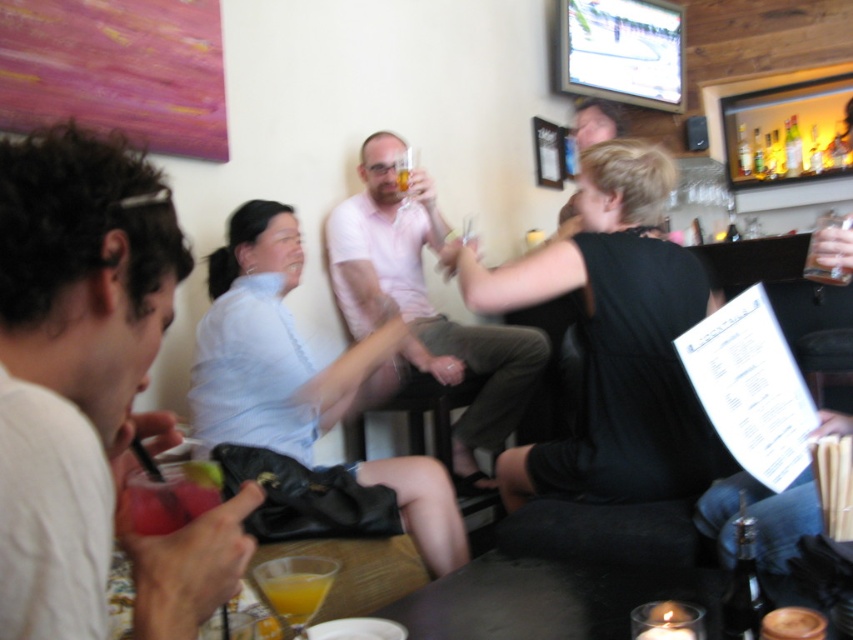
You are a bartender who needs to place a new order of drinks on the table. The table has limited space. Based on the scene, which item, the light blue shirt at center or the translucent glass bottles at upper right, takes up more horizontal space and might require more careful placement?

The light blue shirt at center has a larger width than the translucent glass bottles at upper right, so it occupies more horizontal space and requires more careful placement to ensure there is enough room for the new drinks.

You are standing at the entrance of the bar and want to locate the person wearing the light blue shirt at center. According to the coordinates provided, in which direction should you look relative to the center of the image?

The light blue shirt at center is located at coordinates point (277,346), which is slightly to the right and above the center of the image.